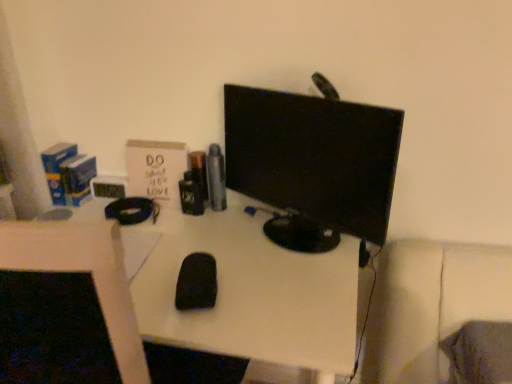
Question: Considering their positions, is black matte mouse at center located in front of or behind black glossy monitor at center?

Choices:
 (A) front
 (B) behind

Answer: (A)

Question: Looking at the image, does black matte mouse at center seem bigger or smaller compared to black glossy monitor at center?

Choices:
 (A) big
 (B) small

Answer: (A)

Question: Which object is positioned farthest from the black matte mouse at center?

Choices:
 (A) black matte mouse at center
 (B) black glossy monitor at center

Answer: (B)

Question: Which object is positioned farthest from the black matte mouse at center?

Choices:
 (A) black matte mouse at center
 (B) black glossy monitor at center

Answer: (B)